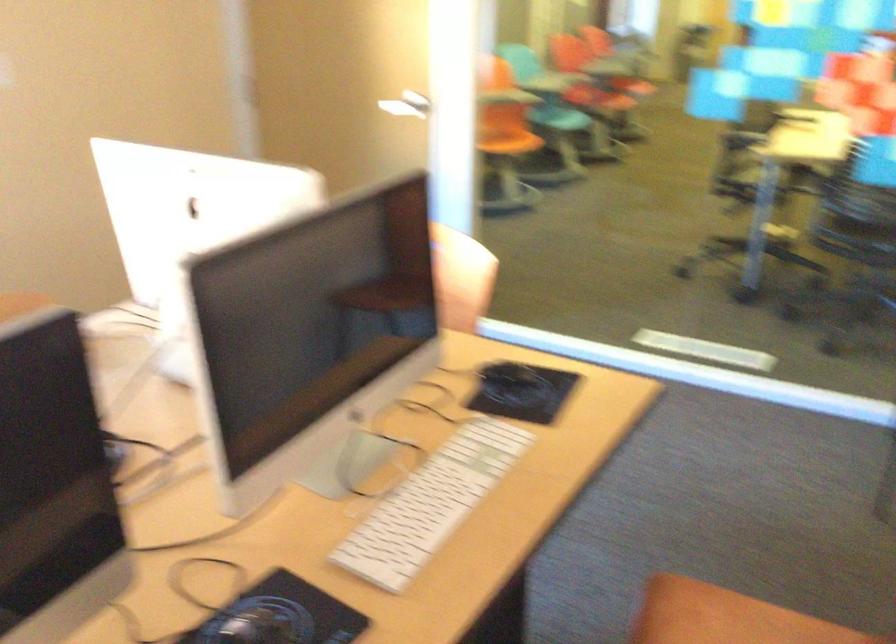
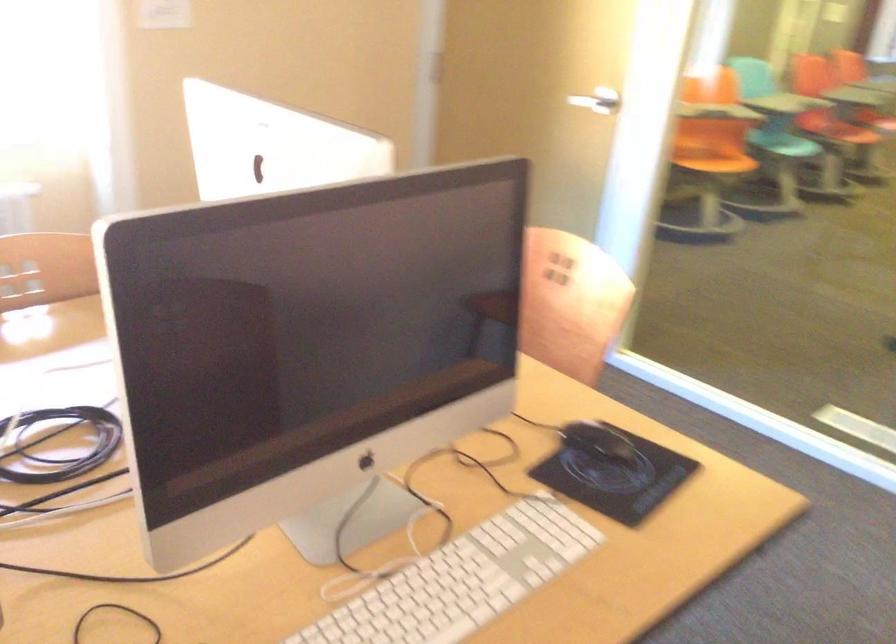
Question: The first image is from the beginning of the video and the second image is from the end. How did the camera likely rotate when shooting the video?

Choices:
 (A) Left
 (B) Right
 (C) Up
 (D) Down

Answer: (A)